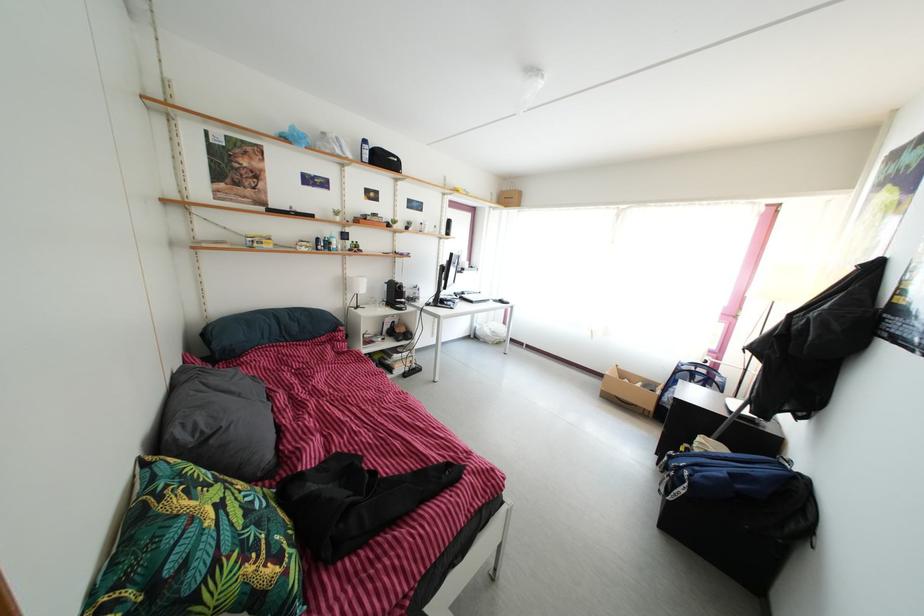
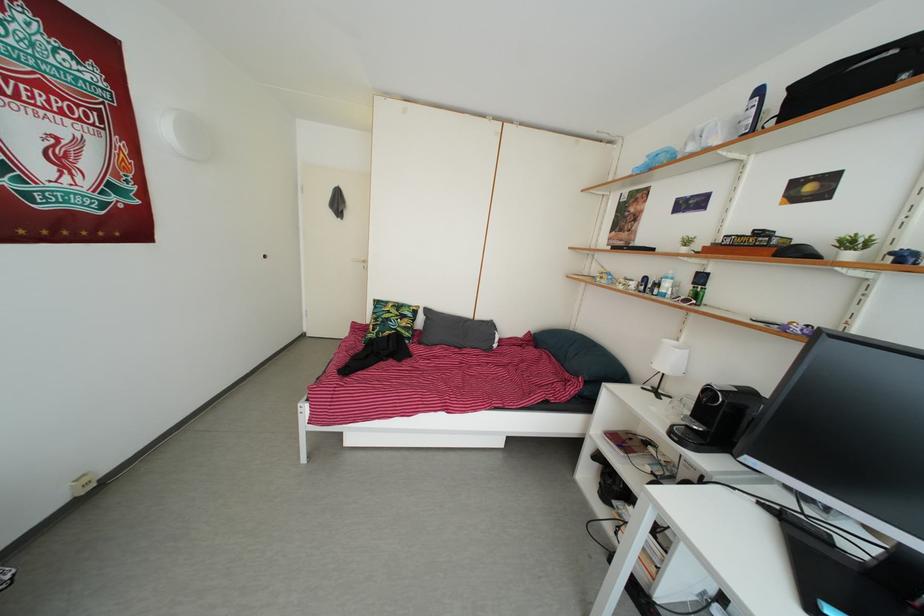
The point at (313,254) is marked in the first image. Where is the corresponding point in the second image?

(630, 293)